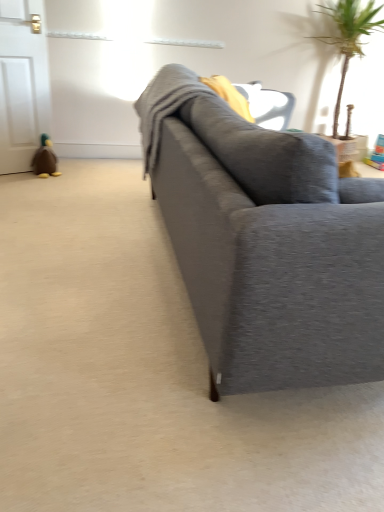
Question: In the image, is green leafy plant at upper right positioned in front of or behind matte gray couch at center?

Choices:
 (A) behind
 (B) front

Answer: (A)

Question: Considering the positions of green leafy plant at upper right and matte gray couch at center in the image, is green leafy plant at upper right taller or shorter than matte gray couch at center?

Choices:
 (A) tall
 (B) short

Answer: (A)

Question: Based on their relative distances, which object is nearer to the matte gray couch at center?

Choices:
 (A) green leafy plant at upper right
 (B) brown plush duck at left

Answer: (B)

Question: Estimate the real-world distances between objects in this image. Which object is closer to the matte gray couch at center?

Choices:
 (A) green leafy plant at upper right
 (B) brown plush duck at left

Answer: (B)